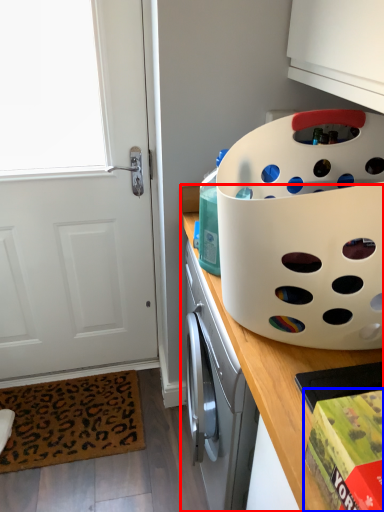
Question: Which point is further to the camera, countertop (highlighted by a red box) or box (highlighted by a blue box)?

Choices:
 (A) countertop
 (B) box

Answer: (A)